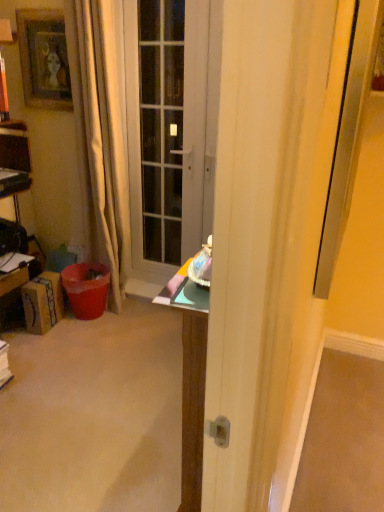
Question: From the image's perspective, does beige fabric curtain at left appear higher than wooden framed picture at upper left?

Choices:
 (A) no
 (B) yes

Answer: (A)

Question: From a real-world perspective, is beige fabric curtain at left under wooden framed picture at upper left?

Choices:
 (A) no
 (B) yes

Answer: (B)

Question: Are beige fabric curtain at left and wooden framed picture at upper left located far from each other?

Choices:
 (A) yes
 (B) no

Answer: (B)

Question: Considering the relative sizes of beige fabric curtain at left and wooden framed picture at upper left in the image provided, is beige fabric curtain at left wider than wooden framed picture at upper left?

Choices:
 (A) yes
 (B) no

Answer: (A)

Question: Does beige fabric curtain at left have a smaller size compared to wooden framed picture at upper left?

Choices:
 (A) yes
 (B) no

Answer: (B)

Question: Is wooden framed picture at upper left wider or thinner than brushed metal drawer at left?

Choices:
 (A) thin
 (B) wide

Answer: (A)

Question: Is wooden framed picture at upper left bigger or smaller than brushed metal drawer at left?

Choices:
 (A) big
 (B) small

Answer: (A)

Question: Considering the positions of point (51, 11) and point (21, 269), is point (51, 11) closer or farther from the camera than point (21, 269)?

Choices:
 (A) closer
 (B) farther

Answer: (A)

Question: Is wooden framed picture at upper left in front of or behind brushed metal drawer at left in the image?

Choices:
 (A) front
 (B) behind

Answer: (B)

Question: In the image, is beige fabric curtain at left positioned in front of or behind matte gray door at center?

Choices:
 (A) front
 (B) behind

Answer: (A)

Question: From the image's perspective, is beige fabric curtain at left positioned above or below matte gray door at center?

Choices:
 (A) below
 (B) above

Answer: (A)

Question: Is point (74, 4) closer or farther from the camera than point (142, 120)?

Choices:
 (A) closer
 (B) farther

Answer: (A)

Question: Is beige fabric curtain at left spatially inside matte gray door at center, or outside of it?

Choices:
 (A) outside
 (B) inside

Answer: (A)

Question: Is brushed metal drawer at left wider or thinner than wooden framed picture at upper left?

Choices:
 (A) thin
 (B) wide

Answer: (B)

Question: Is point (21, 271) closer or farther from the camera than point (21, 52)?

Choices:
 (A) farther
 (B) closer

Answer: (A)